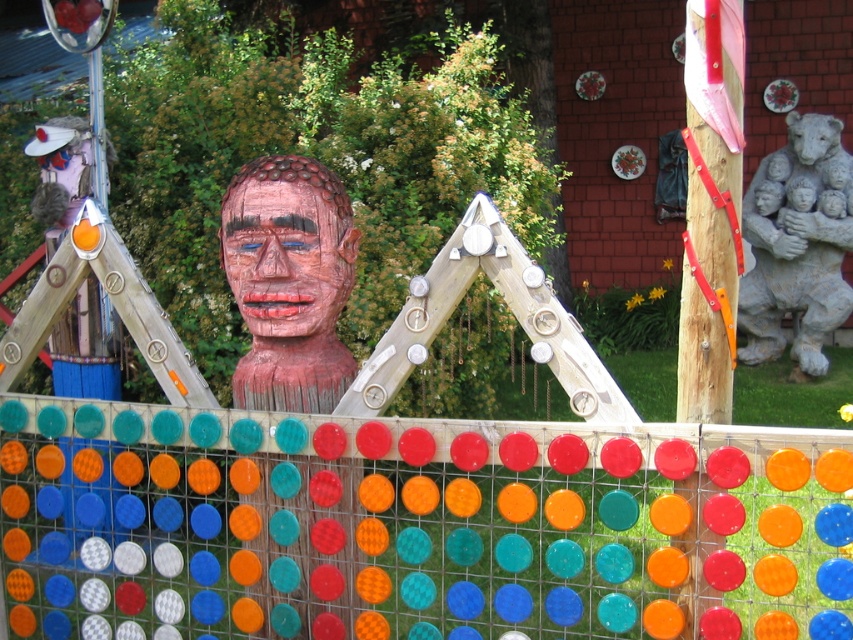
You are an art student analyzing the outdoor installation. You notice two wooden structures at the center of the scene. Which one is closer to you, the wooden head at center or the wooden mask at center?

The wooden head at center is closer to you than the wooden mask at center.

You are an artist planning to install a new sculpture in your garden. You have two options from the image provided. The wooden head at center and the wooden mask at center. Which one is taller?

The wooden head at center is much taller than the wooden mask at center.